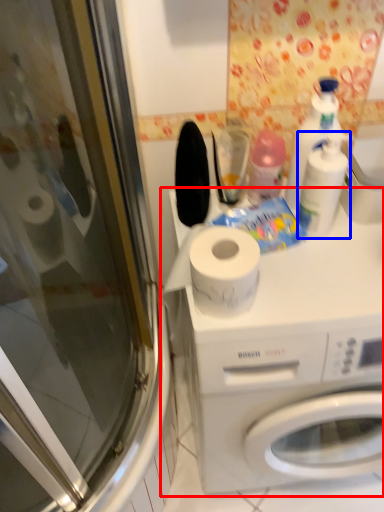
Question: Which point is closer to the camera, washing machine (highlighted by a red box) or cleaning product (highlighted by a blue box)?

Choices:
 (A) washing machine
 (B) cleaning product

Answer: (A)